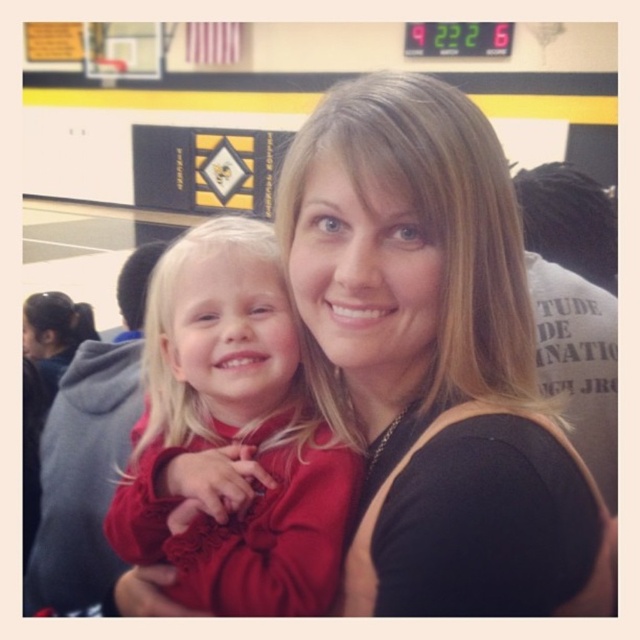
Question: Which object appears closest to the camera in this image?

Choices:
 (A) matte red dress at center
 (B) black fabric at center

Answer: (B)

Question: Does black fabric at center appear under matte red dress at center?

Choices:
 (A) yes
 (B) no

Answer: (B)

Question: Does black fabric at center appear over matte red dress at center?

Choices:
 (A) no
 (B) yes

Answer: (B)

Question: Is black fabric at center bigger than matte red dress at center?

Choices:
 (A) no
 (B) yes

Answer: (A)

Question: Which point is closer to the camera taking this photo?

Choices:
 (A) (304, 580)
 (B) (433, 461)

Answer: (B)